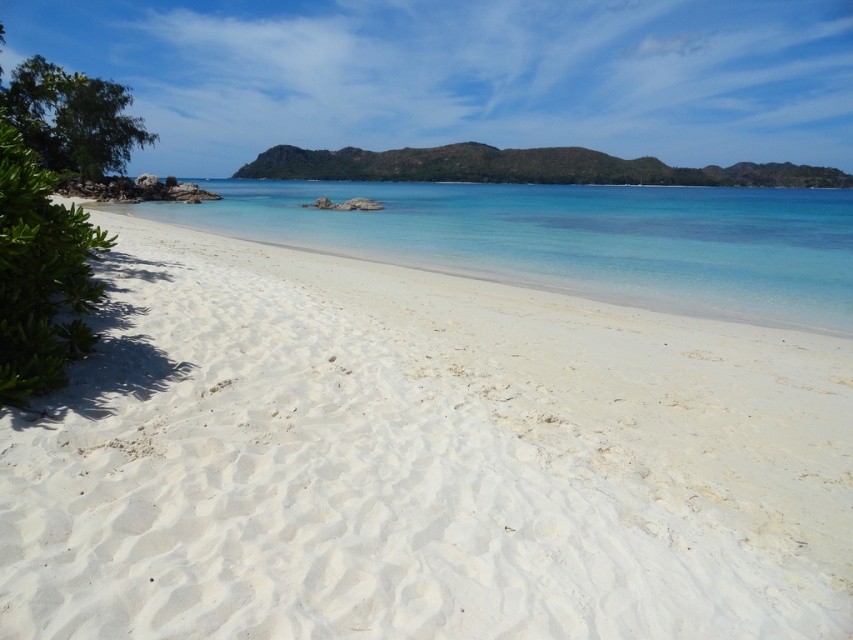
Question: Can you confirm if white sandy beach at center is positioned to the left of green rocky island at center?

Choices:
 (A) no
 (B) yes

Answer: (B)

Question: Which of the following is the farthest from the observer?

Choices:
 (A) green rocky island at center
 (B) white sandy beach at center

Answer: (A)

Question: Which point appears closest to the camera in this image?

Choices:
 (A) (6, 413)
 (B) (776, 179)
 (C) (782, 266)

Answer: (A)

Question: Which point is closer to the camera taking this photo?

Choices:
 (A) (630, 230)
 (B) (786, 180)

Answer: (A)

Question: Can you confirm if white sandy beach at center is wider than green rocky island at center?

Choices:
 (A) yes
 (B) no

Answer: (B)

Question: Does white sandy beach at center have a greater width compared to green rocky island at center?

Choices:
 (A) yes
 (B) no

Answer: (B)